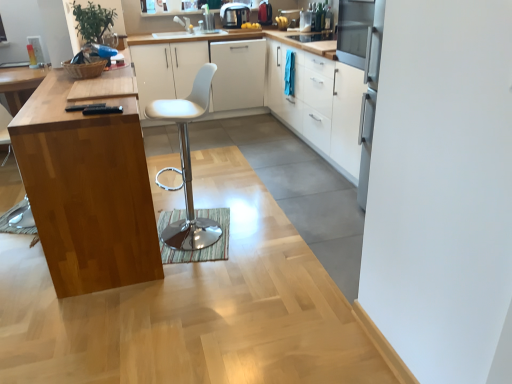
Find the location of a particular element. The width and height of the screenshot is (512, 384). free space to the right of wooden cutting board at left is located at coordinates (263, 221).